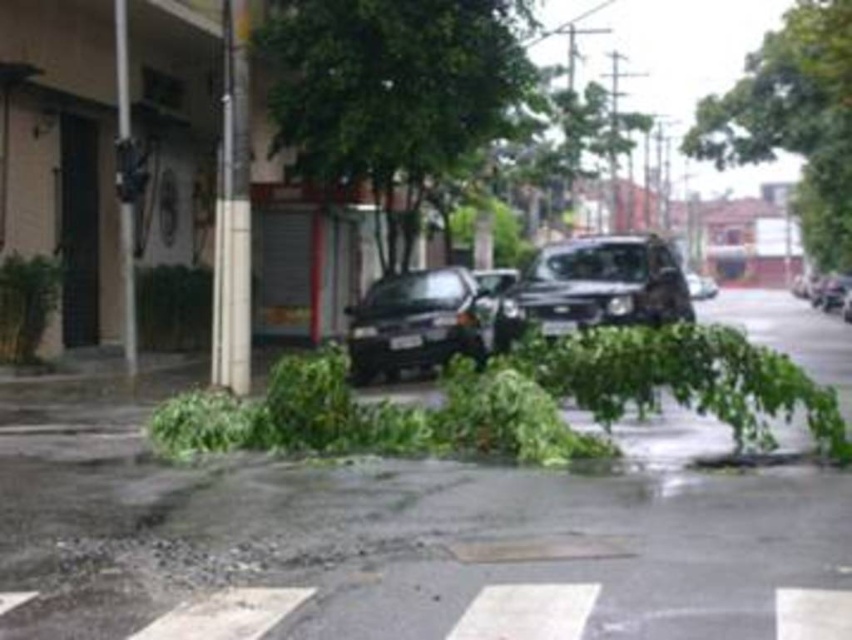
Describe the element at coordinates (417, 323) in the screenshot. I see `glossy black car at center` at that location.

Which is above, glossy black car at center or shiny black car at right?

Positioned higher is shiny black car at right.

Who is more distant from viewer, (471,292) or (838,275)?

Positioned behind is point (838,275).

Locate an element on the screen. This screenshot has height=640, width=852. glossy black car at center is located at coordinates (417, 323).

Describe the element at coordinates (392, 93) in the screenshot. This screenshot has width=852, height=640. I see `green leafy tree at center` at that location.

Is green leafy tree at center above green leafy tree at upper right?

No, green leafy tree at center is not above green leafy tree at upper right.

Who is more forward, (347, 12) or (726, 120)?

Point (347, 12)

I want to click on green leafy tree at center, so click(392, 93).

Does green leafy tree at upper right appear on the right side of satin black suv at center?

Indeed, green leafy tree at upper right is positioned on the right side of satin black suv at center.

Is point (718, 140) positioned before point (631, 253)?

No, (718, 140) is further to viewer.

Image resolution: width=852 pixels, height=640 pixels. Identify the location of green leafy tree at upper right. (793, 120).